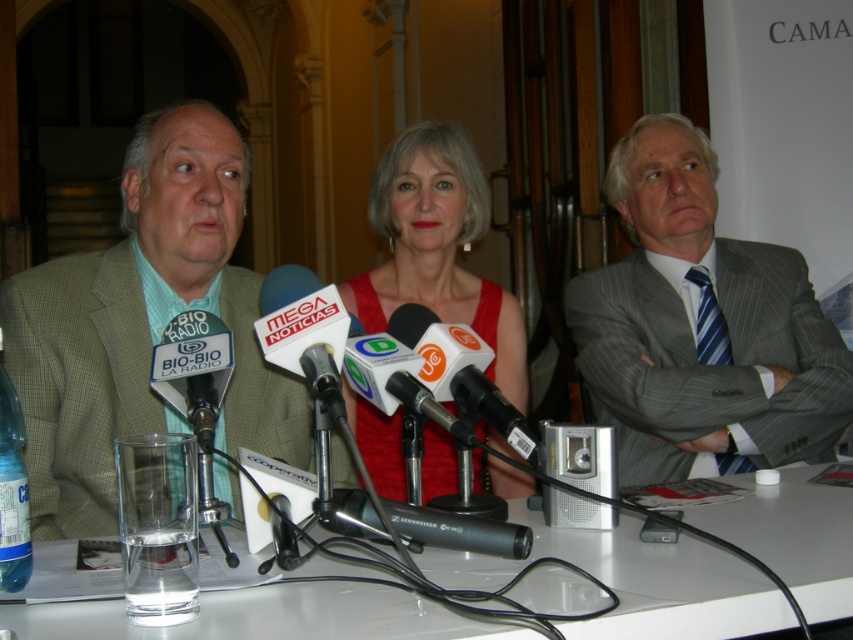
Does gray pinstripe suit at center have a greater height compared to red satin dress at center?

In fact, gray pinstripe suit at center may be shorter than red satin dress at center.

Measure the distance between gray pinstripe suit at center and camera.

A distance of 1.91 meters exists between gray pinstripe suit at center and camera.

Where is `gray pinstripe suit at center`? The height and width of the screenshot is (640, 853). gray pinstripe suit at center is located at coordinates (701, 326).

This screenshot has height=640, width=853. I want to click on gray pinstripe suit at center, so click(701, 326).

Between point (746, 465) and point (177, 252), which one is positioned in front?

Point (177, 252)

Image resolution: width=853 pixels, height=640 pixels. Identify the location of gray pinstripe suit at center. (701, 326).

Is gray pinstripe suit at center above clear glass table at center?

Yes, gray pinstripe suit at center is above clear glass table at center.

Which is below, gray pinstripe suit at center or clear glass table at center?

Positioned lower is clear glass table at center.

Between point (676, 472) and point (679, 602), which one is positioned behind?

The point (676, 472) is more distant.

Identify the location of gray pinstripe suit at center. Image resolution: width=853 pixels, height=640 pixels. (701, 326).